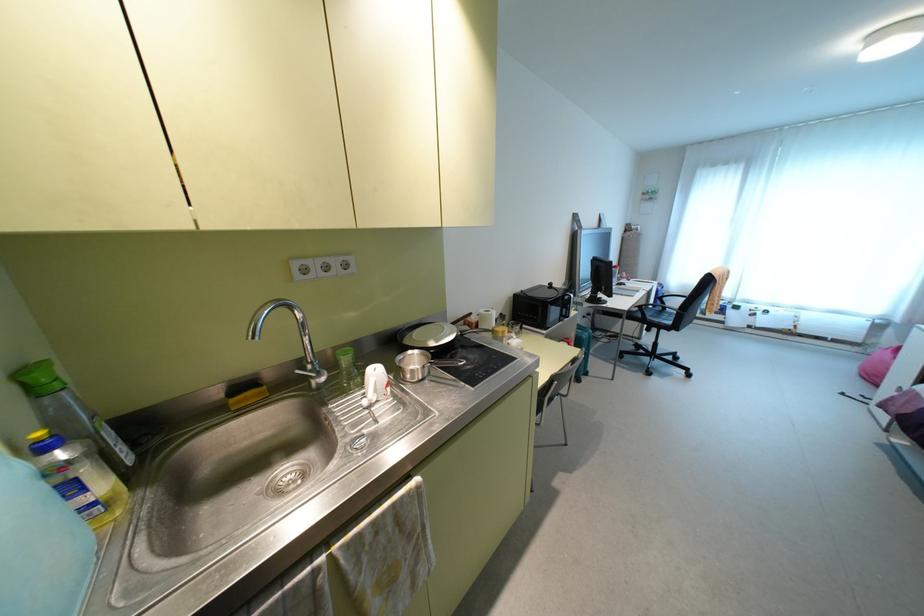
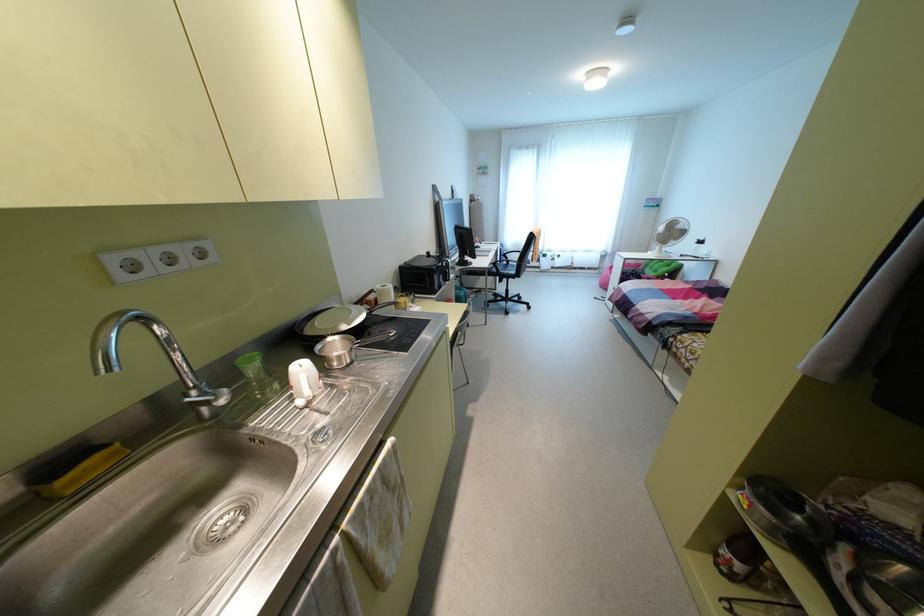
Where in the second image is the point corresponding to the point at 468,368 from the first image?

(392, 339)